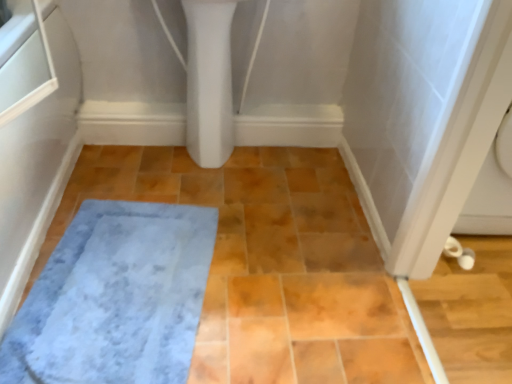
You are a GUI agent. You are given a task and a screenshot of the screen. Output one action in this format:
    pyautogui.click(x=<x>, y=<y>)
    Task: Click on the free space to the right of white glossy bidet at upper center
    This screenshot has width=512, height=384.
    Given the screenshot: What is the action you would take?
    pyautogui.click(x=255, y=168)